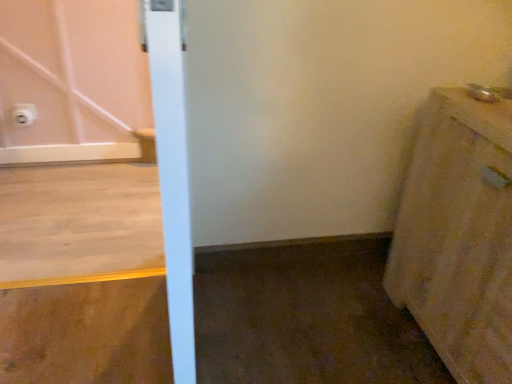
Question: Does beige fabric cabinet at right come in front of white plastic electric outlet at upper left?

Choices:
 (A) no
 (B) yes

Answer: (B)

Question: Is beige fabric cabinet at right positioned with its back to white plastic electric outlet at upper left?

Choices:
 (A) yes
 (B) no

Answer: (B)

Question: Does beige fabric cabinet at right appear on the left side of white plastic electric outlet at upper left?

Choices:
 (A) yes
 (B) no

Answer: (B)

Question: Would you say white plastic electric outlet at upper left is part of beige fabric cabinet at right's contents?

Choices:
 (A) no
 (B) yes

Answer: (A)

Question: Is beige fabric cabinet at right wider than white plastic electric outlet at upper left?

Choices:
 (A) no
 (B) yes

Answer: (B)

Question: Does beige fabric cabinet at right come behind white plastic electric outlet at upper left?

Choices:
 (A) no
 (B) yes

Answer: (A)

Question: From a real-world perspective, is white plastic electric outlet at upper left on beige fabric cabinet at right?

Choices:
 (A) yes
 (B) no

Answer: (B)

Question: Does white plastic electric outlet at upper left have a greater width compared to beige fabric cabinet at right?

Choices:
 (A) no
 (B) yes

Answer: (A)

Question: Is white plastic electric outlet at upper left next to beige fabric cabinet at right and touching it?

Choices:
 (A) yes
 (B) no

Answer: (B)

Question: Is white plastic electric outlet at upper left to the right of beige fabric cabinet at right from the viewer's perspective?

Choices:
 (A) yes
 (B) no

Answer: (B)

Question: Considering the relative sizes of white plastic electric outlet at upper left and beige fabric cabinet at right in the image provided, is white plastic electric outlet at upper left thinner than beige fabric cabinet at right?

Choices:
 (A) no
 (B) yes

Answer: (B)

Question: From the image's perspective, does white plastic electric outlet at upper left appear lower than beige fabric cabinet at right?

Choices:
 (A) yes
 (B) no

Answer: (B)

Question: Considering the positions of white plastic electric outlet at upper left and beige fabric cabinet at right in the image, is white plastic electric outlet at upper left wider or thinner than beige fabric cabinet at right?

Choices:
 (A) wide
 (B) thin

Answer: (B)